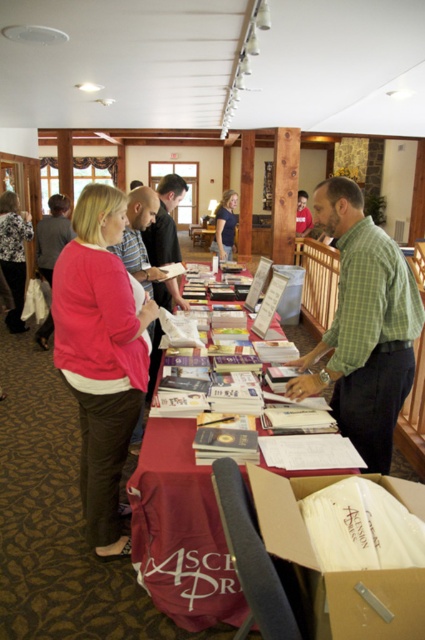
Question: Observing the image, what is the correct spatial positioning of white paper table at center in reference to blue cotton shirt at center?

Choices:
 (A) right
 (B) left

Answer: (B)

Question: Which object is farther from the camera taking this photo?

Choices:
 (A) pink sweater at left
 (B) white paper table at center
 (C) floral-patterned blouse at center
 (D) blue cotton shirt at center

Answer: (D)

Question: Is white paper table at center closer to the viewer compared to blue cotton shirt at center?

Choices:
 (A) no
 (B) yes

Answer: (B)

Question: Does green checkered shirt at center have a greater width compared to floral-patterned blouse at center?

Choices:
 (A) no
 (B) yes

Answer: (B)

Question: Which object is positioned closest to the white paper table at center?

Choices:
 (A) blue cotton shirt at center
 (B) pink sweater at left
 (C) green checkered shirt at center
 (D) floral-patterned blouse at center

Answer: (B)

Question: Which object is farther from the camera taking this photo?

Choices:
 (A) pink sweater at left
 (B) green checkered shirt at center
 (C) white paper table at center

Answer: (A)